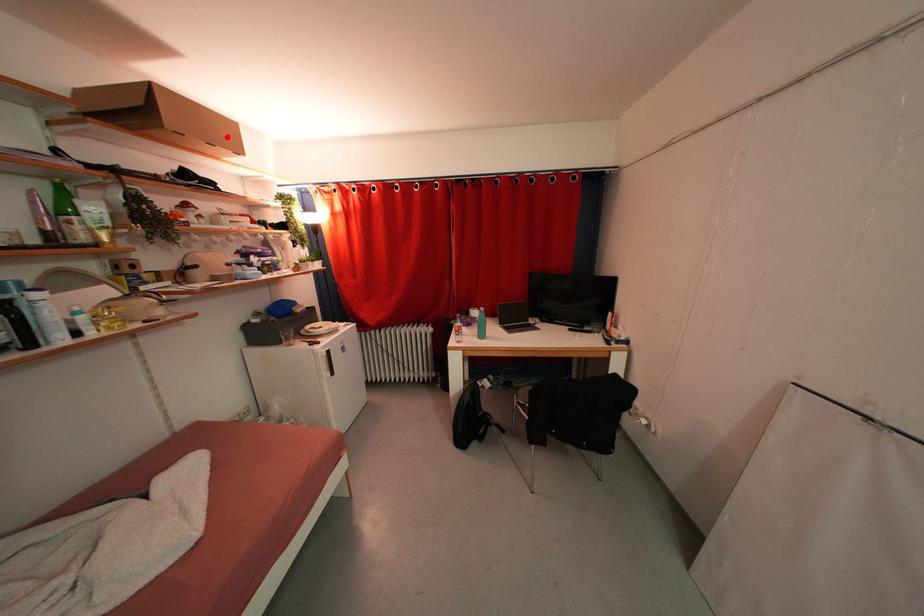
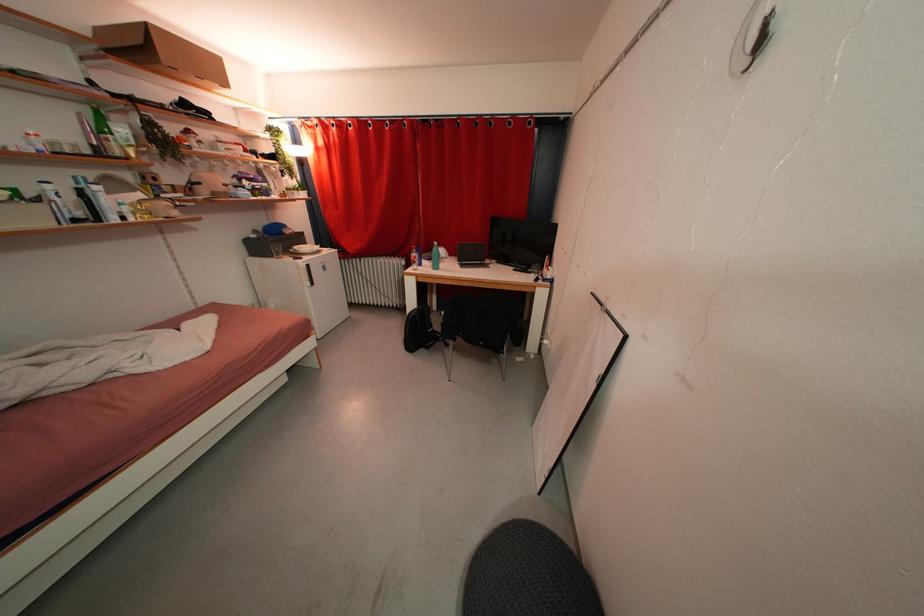
In the second image, find the point that corresponds to the highlighted location in the first image.

(214, 71)